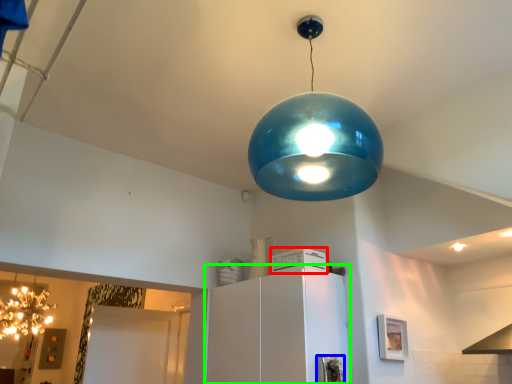
Question: Based on their relative distances, which object is nearer to appliance (highlighted by a red box)? Choose from appliance (highlighted by a blue box) and cabinetry (highlighted by a green box).

Choices:
 (A) appliance
 (B) cabinetry

Answer: (B)